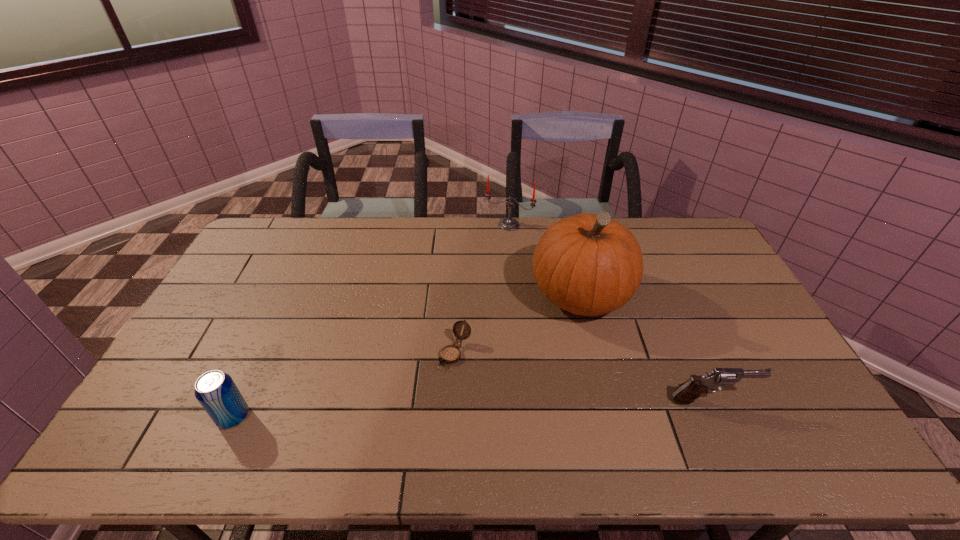
At what (x,y) coordinates should I click in order to perform the action: click on vacant area situated on the front-facing side of the candle. Please return your answer as a coordinate pair (x, y). Looking at the image, I should click on (494, 247).

Locate an element on the screen. The height and width of the screenshot is (540, 960). vacant region located 0.160m on the front-facing side of the candle is located at coordinates 491,256.

The image size is (960, 540). In order to click on free space located on the front-facing side of the candle in this screenshot , I will do `click(485, 270)`.

Identify the location of vacant space located on the stem of the second farthest object. (539, 338).

Where is `vacant region located 0.290m on the stem of the second farthest object`? The height and width of the screenshot is (540, 960). vacant region located 0.290m on the stem of the second farthest object is located at coordinates (491, 385).

Locate an element on the screen. free space located on the stem of the second farthest object is located at coordinates (517, 358).

Identify the location of vacant region located on the face of the fourth object from right to left. This screenshot has width=960, height=540. (416, 407).

I want to click on vacant space situated on the face of the fourth object from right to left, so click(x=418, y=404).

The width and height of the screenshot is (960, 540). Find the location of `free space located on the face of the fourth object from right to left`. free space located on the face of the fourth object from right to left is located at coordinates [x=420, y=401].

This screenshot has width=960, height=540. I want to click on object that is at the far edge, so click(x=509, y=224).